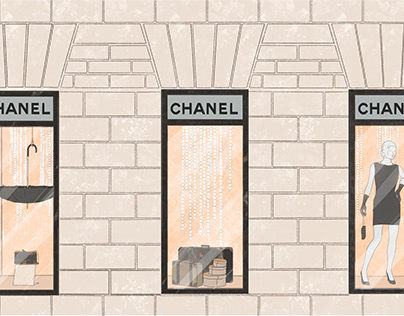
The image size is (404, 316). In order to click on left of window in this screenshot , I will do `click(148, 187)`.